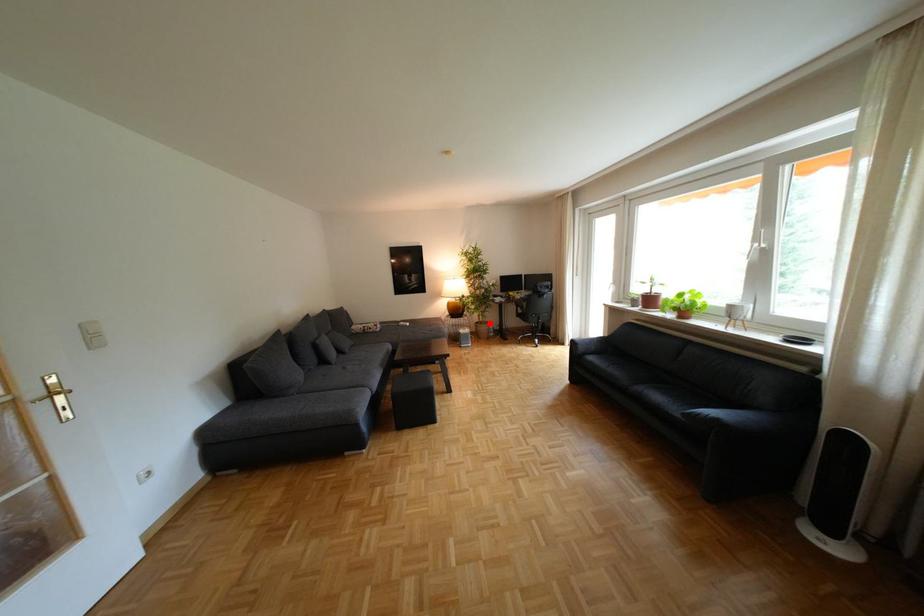
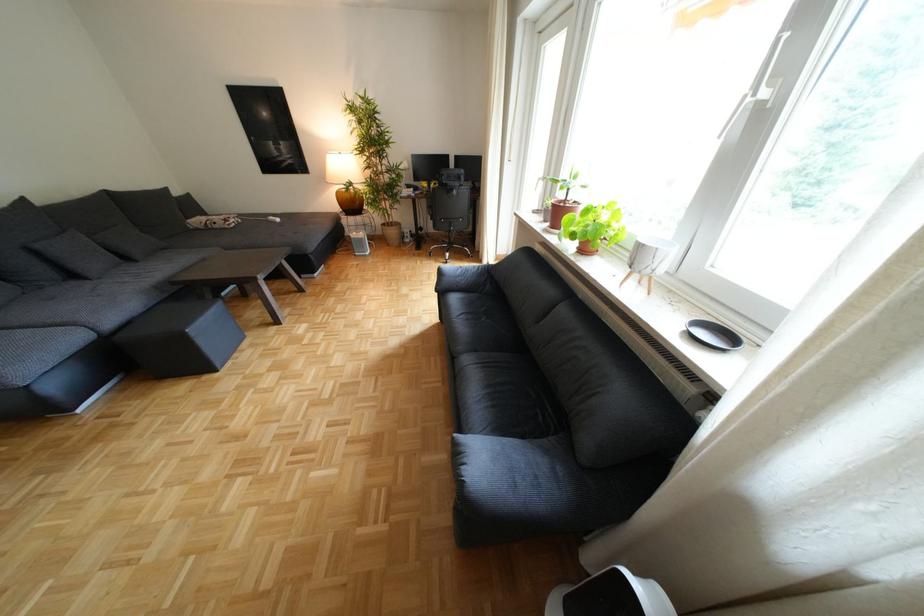
Locate, in the second image, the point that corresponds to the highlighted location in the first image.

(396, 224)